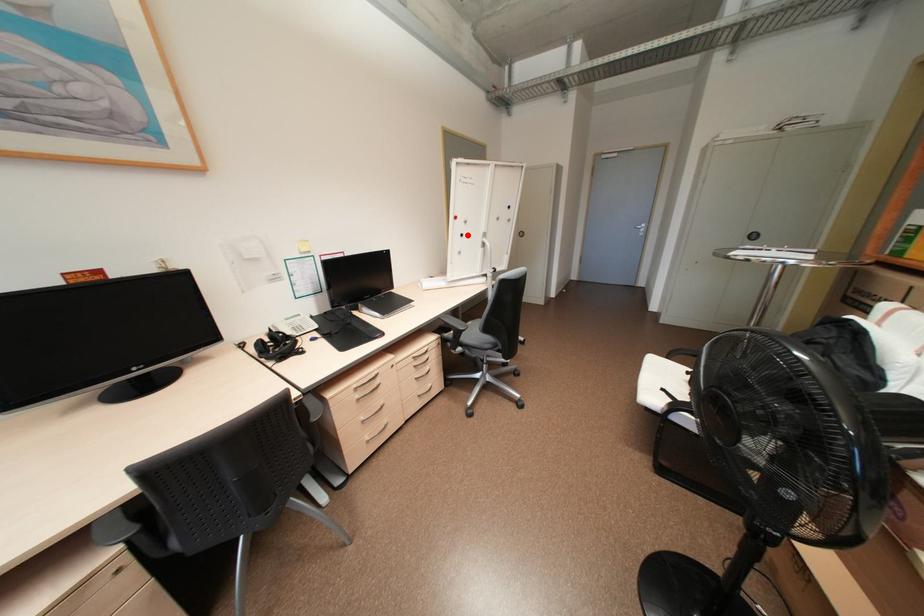
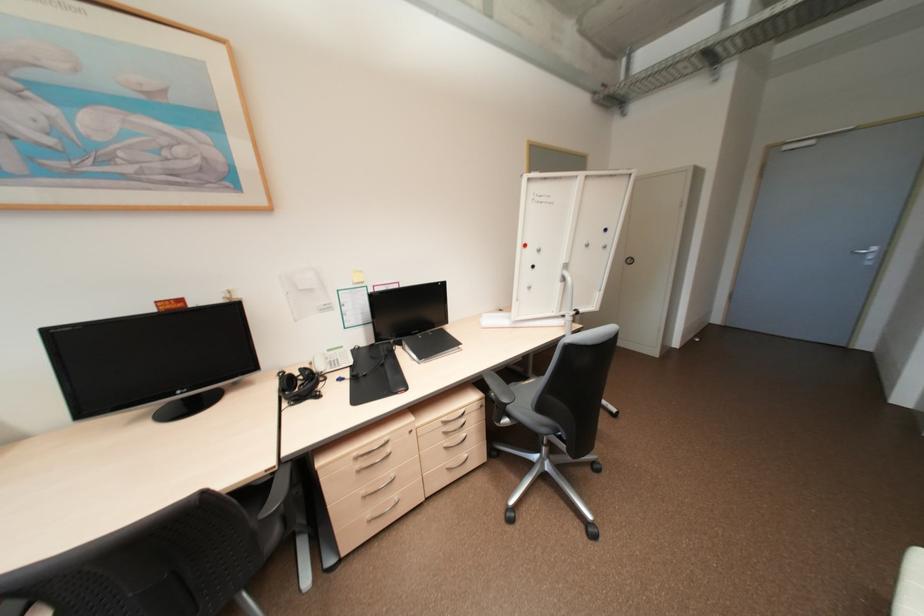
Find the pixel in the second image that matches the highlighted location in the first image.

(539, 265)